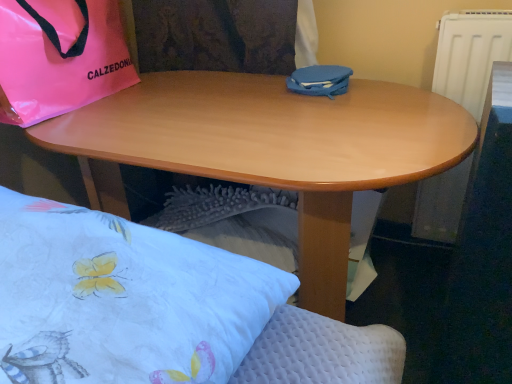
The height and width of the screenshot is (384, 512). Identify the location of free space in front of blue matte case at center. (335, 106).